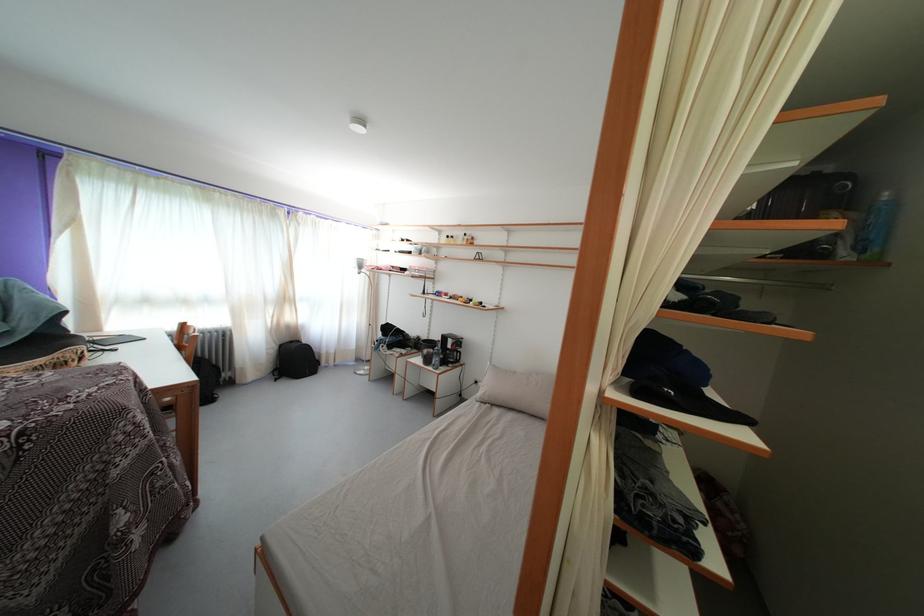
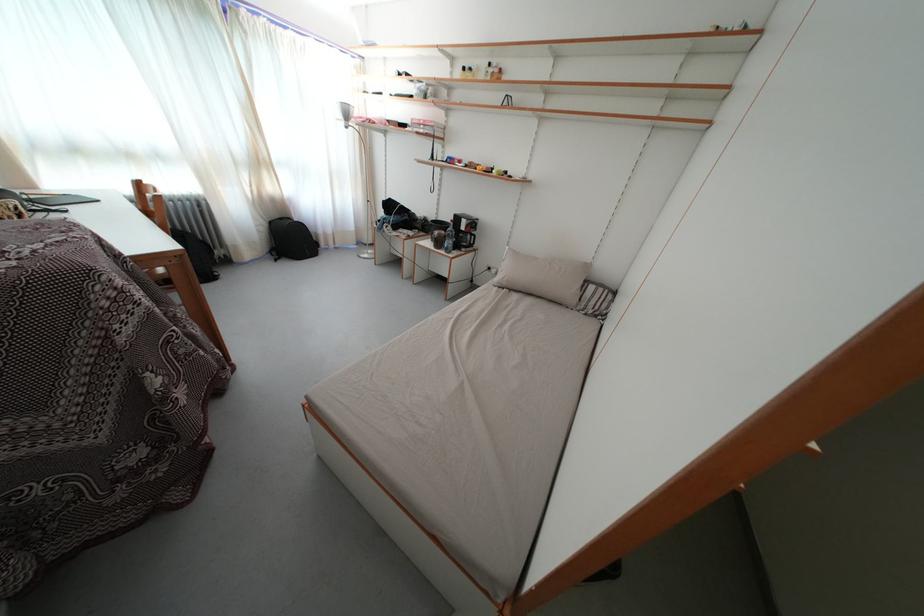
The point at (282, 353) is marked in the first image. Where is the corresponding point in the second image?

(272, 230)